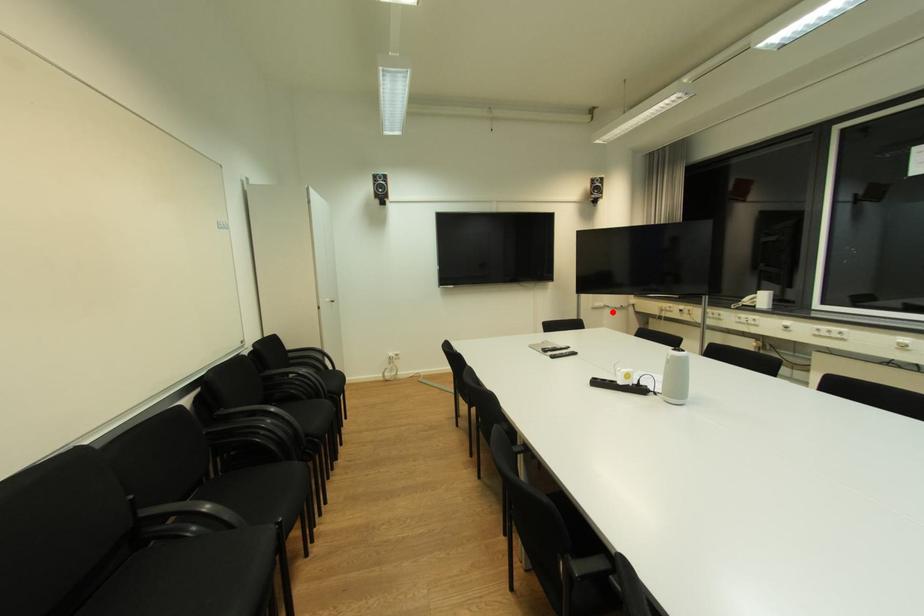
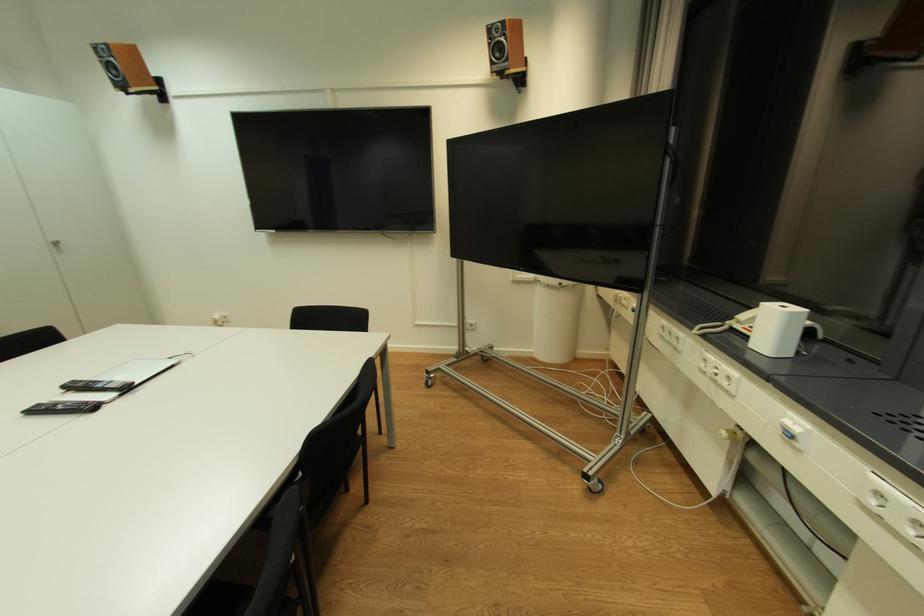
Locate, in the second image, the point that corresponds to the highlighted location in the first image.

(544, 290)